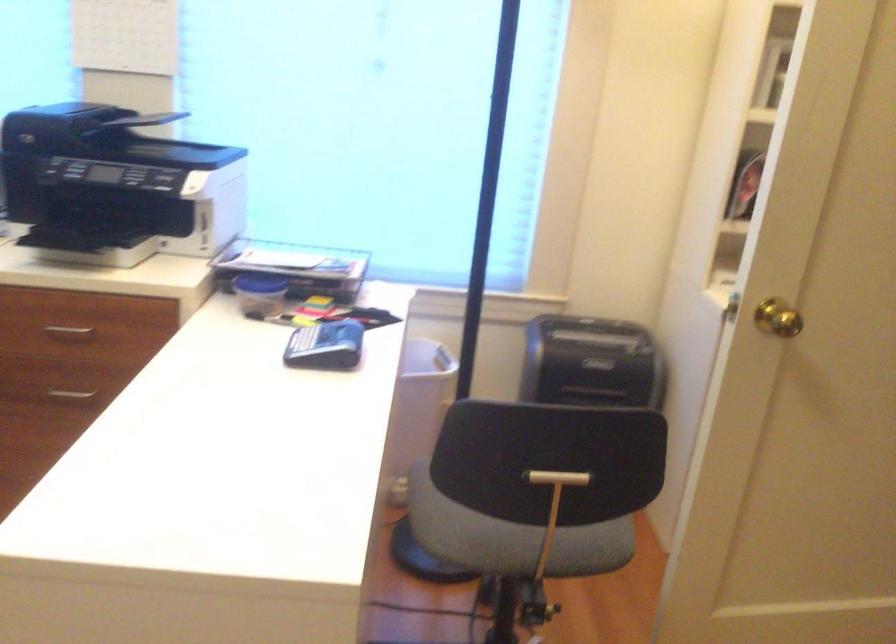
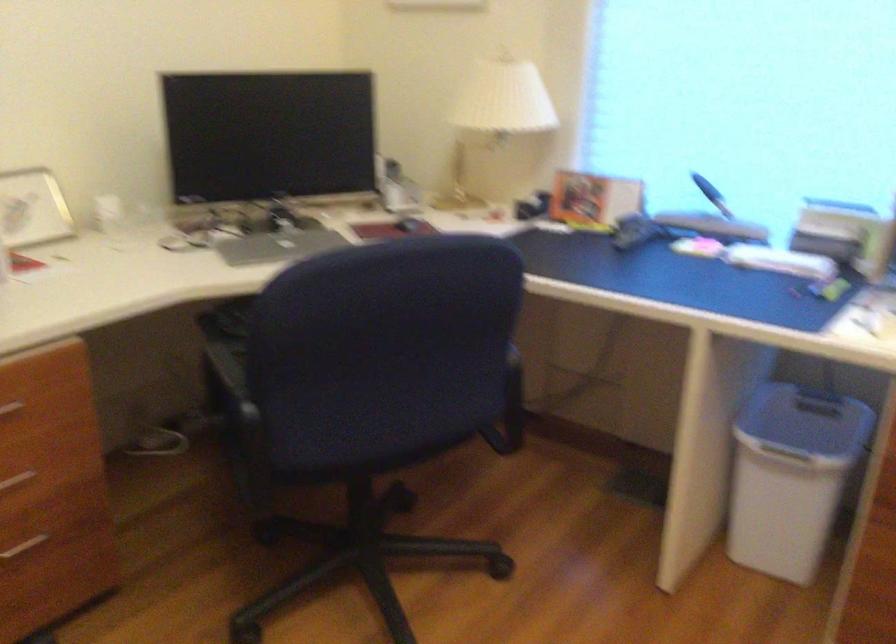
Question: How did the camera likely rotate?

Choices:
 (A) Left
 (B) Right
 (C) Up
 (D) Down

Answer: (A)